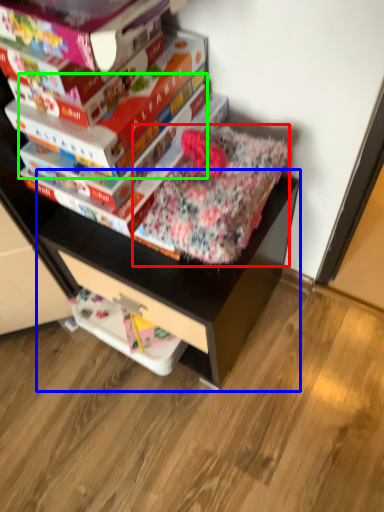
Question: Considering the real-world distances, which object is closest to bedding (highlighted by a red box)? computer desk (highlighted by a blue box) or paperback book (highlighted by a green box).

Choices:
 (A) computer desk
 (B) paperback book

Answer: (B)